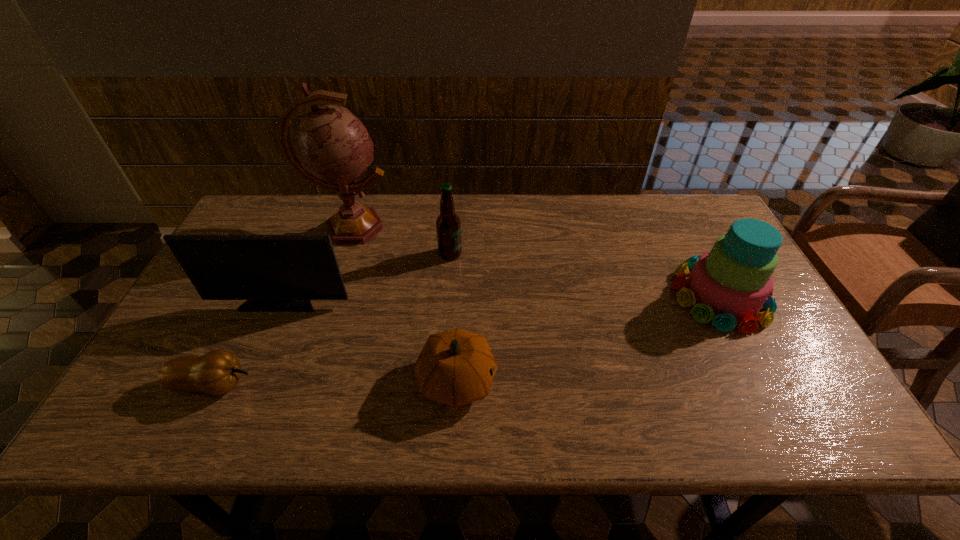
Locate an element on the screen. vacant position located 0.180m on the label of the beer bottle is located at coordinates (521, 254).

This screenshot has width=960, height=540. I want to click on vacant space located 0.210m on the back of the cake, so click(x=681, y=219).

Where is `vacant region located on the side of the fifth tallest object with the carved face`? The image size is (960, 540). vacant region located on the side of the fifth tallest object with the carved face is located at coordinates (549, 381).

Locate an element on the screen. The width and height of the screenshot is (960, 540). vacant region located 0.240m on the stem side of the left gourd is located at coordinates (358, 384).

Find the location of a particular element. object at the far edge is located at coordinates (333, 149).

At what (x,y) coordinates should I click in order to perform the action: click on monitor present at the left edge. Please return your answer as a coordinate pair (x, y). Looking at the image, I should click on (275, 273).

Where is `gourd located in the left edge section of the desktop`? The image size is (960, 540). gourd located in the left edge section of the desktop is located at coordinates (217, 372).

I want to click on object that is positioned at the right edge, so click(730, 284).

Where is `object that is at the near left corner`? object that is at the near left corner is located at coordinates (217, 372).

The width and height of the screenshot is (960, 540). I want to click on blank space at the far edge of the desktop, so click(655, 194).